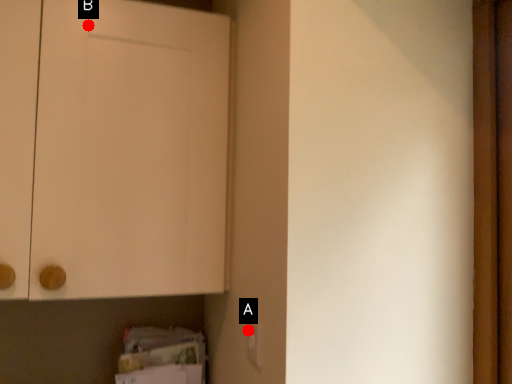
Question: Two points are circled on the image, labeled by A and B beside each circle. Which of the following is the farthest from the observer?

Choices:
 (A) A is further
 (B) B is further

Answer: (B)